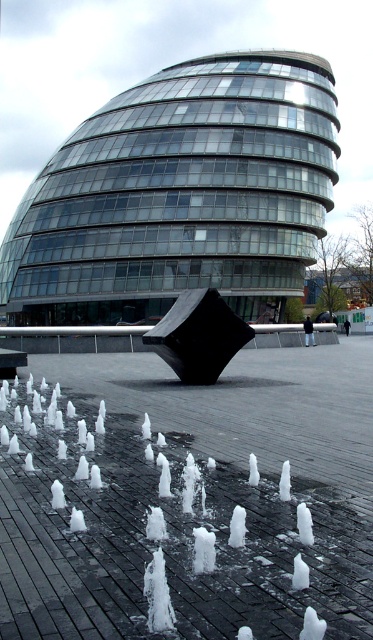
Which is more to the right, transparent glass building at center or black polished cube at center?

Positioned to the right is black polished cube at center.

Between point (136, 257) and point (234, 349), which one is positioned behind?

Point (136, 257)

Is point (182, 124) closer to viewer compared to point (186, 353)?

No, (182, 124) is further to viewer.

In order to click on transparent glass building at center in this screenshot , I will do 180,195.